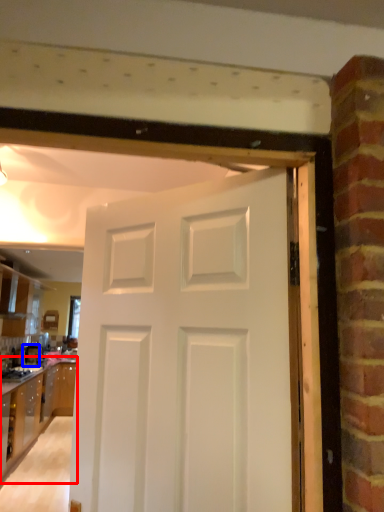
Question: Which object appears closest to the camera in this image, cabinetry (highlighted by a red box) or appliance (highlighted by a blue box)?

Choices:
 (A) cabinetry
 (B) appliance

Answer: (A)